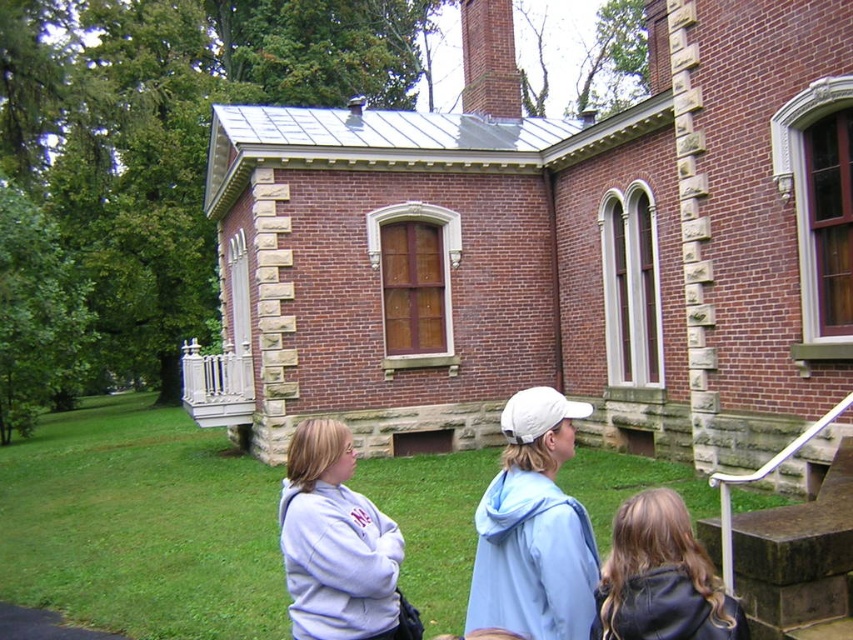
You are standing in front of the historic brick building and want to greet the person wearing the dark brown leather jacket at lower right. Which direction should you walk relative to the light purple fleece at center?

You should walk to the right of the light purple fleece at center to reach the dark brown leather jacket at lower right since the light purple fleece at center is to the left of the dark brown leather jacket at lower right.

You are a photographer standing at the base of the historic brick building. You want to take a photo that includes both the green grass at lower center and the white matte baseball cap at center. Given that your camera has a maximum focus range of 14 meters, will you be able to capture both subjects clearly in the same frame?

The green grass at lower center is 15.03 meters from the white matte baseball cap at center. Since the camera can only focus up to 14 meters, the distance between them exceeds the camera range. Therefore, you cannot capture both subjects clearly in the same frame.

You are a photographer trying to capture a wide shot of the historic brick building. You want to include both the green grass at lower center and the light purple fleece at center in the frame. Based on their distance, will you need to adjust your camera to a wider angle to ensure both are fully visible?

The green grass at lower center and light purple fleece at center are 10.56 meters apart from each other. To include both in the frame, you would need to adjust your camera to a wider angle to ensure both are fully visible.